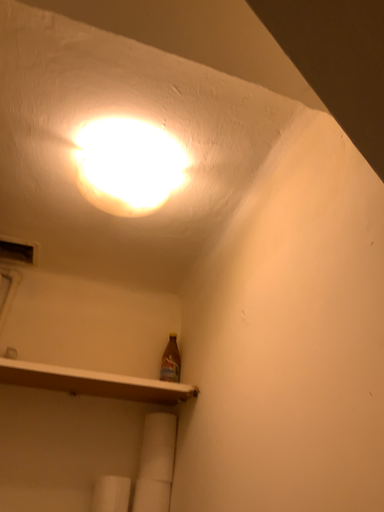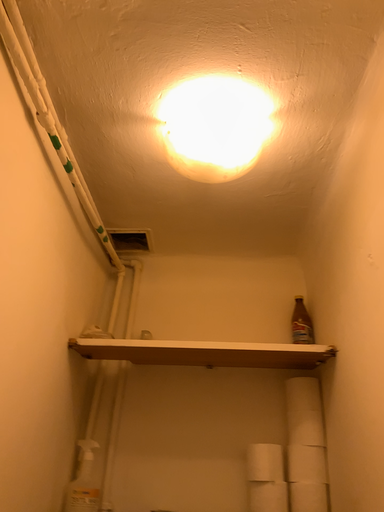
Question: Which way did the camera rotate in the video?

Choices:
 (A) rotated right
 (B) rotated left

Answer: (B)